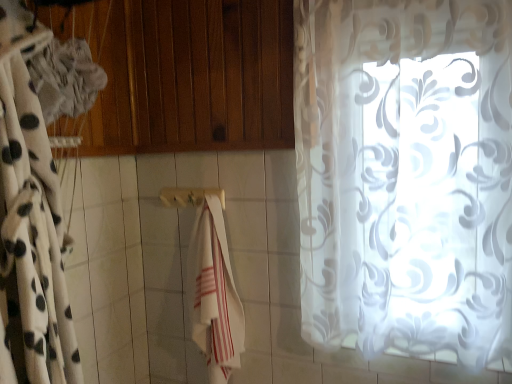
Question: Does white cotton towel at center turn towards white sheer curtain at left, the second curtain viewed from the right?

Choices:
 (A) yes
 (B) no

Answer: (A)

Question: From the image's perspective, is white cotton towel at center below white sheer curtain at left, the second curtain viewed from the right?

Choices:
 (A) no
 (B) yes

Answer: (B)

Question: Are white cotton towel at center and white sheer curtain at left, the second curtain viewed from the right, located far from each other?

Choices:
 (A) yes
 (B) no

Answer: (B)

Question: Is the position of white cotton towel at center less distant than that of white sheer curtain at left, placed as the 1th curtain when sorted from left to right?

Choices:
 (A) yes
 (B) no

Answer: (B)

Question: Considering the relative sizes of white cotton towel at center and white sheer curtain at left, the second curtain viewed from the right, in the image provided, is white cotton towel at center shorter than white sheer curtain at left, the second curtain viewed from the right,?

Choices:
 (A) no
 (B) yes

Answer: (B)

Question: From a real-world perspective, is white cotton towel at center positioned under white sheer curtain at left, the second curtain viewed from the right, based on gravity?

Choices:
 (A) yes
 (B) no

Answer: (A)

Question: Can you confirm if wooden towel bar at center is taller than white sheer curtain at left, the second curtain viewed from the right?

Choices:
 (A) no
 (B) yes

Answer: (A)

Question: From a real-world perspective, is wooden towel bar at center physically below white sheer curtain at left, placed as the 1th curtain when sorted from left to right?

Choices:
 (A) yes
 (B) no

Answer: (A)

Question: From a real-world perspective, is wooden towel bar at center physically above white sheer curtain at left, the second curtain viewed from the right?

Choices:
 (A) no
 (B) yes

Answer: (A)

Question: Can you confirm if wooden towel bar at center is smaller than white sheer curtain at left, placed as the 1th curtain when sorted from left to right?

Choices:
 (A) no
 (B) yes

Answer: (B)

Question: From the image's perspective, is wooden towel bar at center above white sheer curtain at left, placed as the 1th curtain when sorted from left to right?

Choices:
 (A) yes
 (B) no

Answer: (A)

Question: Is wooden towel bar at center closer to the viewer compared to white sheer curtain at left, placed as the 1th curtain when sorted from left to right?

Choices:
 (A) yes
 (B) no

Answer: (B)

Question: Would you say white cotton towel at center is part of transparent floral-patterned curtain at right, which appears as the 2th curtain when viewed from the left,'s contents?

Choices:
 (A) yes
 (B) no

Answer: (B)